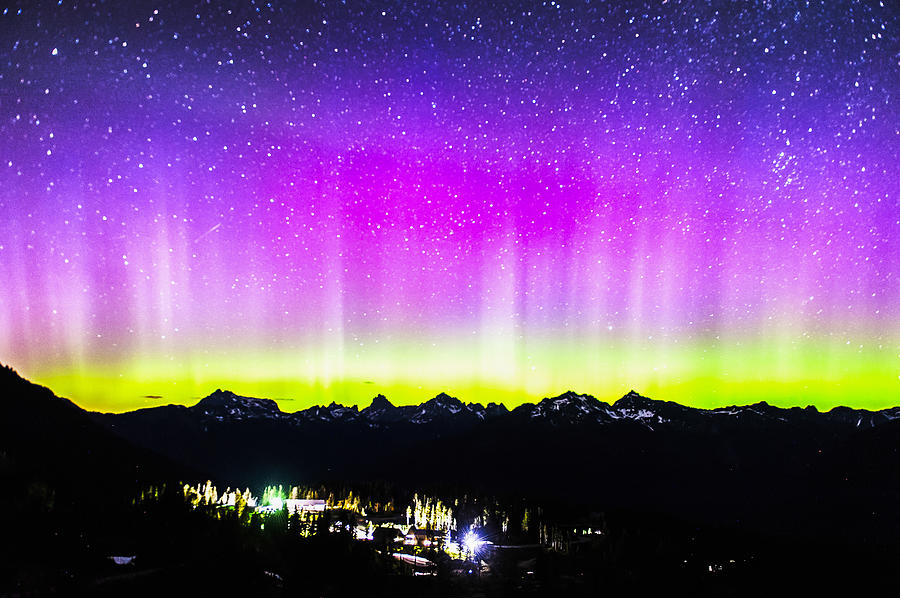
Where is `light`? This screenshot has height=598, width=900. light is located at coordinates tap(489, 556).